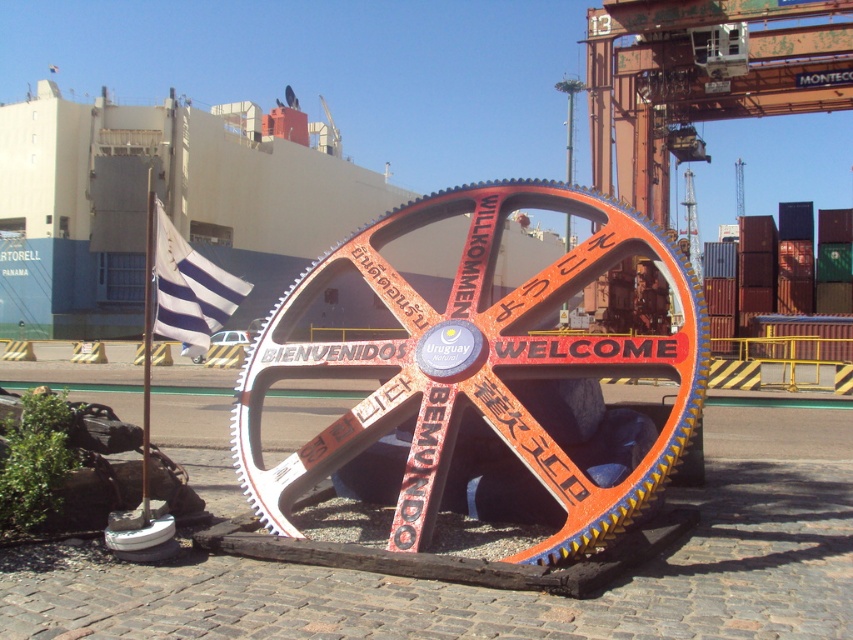
You are an artist planning to photograph the orange painted metal gear at center and the white striped fabric at left. Which object should you focus on to capture the most detailed closeup shot, and why?

The orange painted metal gear at center should be focused on for the most detailed closeup shot because it is wider than the white striped fabric at left, allowing for more intricate details to be captured in the photograph.

You are standing at the center of the gear sculpture and want to place a small flag exactly at the point where the white striped fabric at left is located. What are the coordinates of that point?

The coordinates of the white striped fabric at left are at point (x=189, y=289).